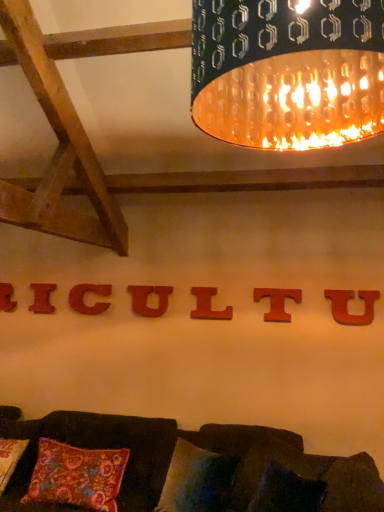
Describe the element at coordinates (277, 302) in the screenshot. I see `wooden letter t at center, which is counted as the sixth alphabet, starting from the left` at that location.

What do you see at coordinates (197, 480) in the screenshot? I see `multicolored fabric pillow at lower center, which appears as the 2th pillow when viewed from the left` at bounding box center [197, 480].

Find the location of a particular element. This screenshot has height=512, width=384. wooden letter l at center, placed as the third alphabet when sorted from right to left is located at coordinates (208, 305).

What is the approximate width of matte wood letter u at center, the 1th alphabet viewed from the right?

matte wood letter u at center, the 1th alphabet viewed from the right, is 2.55 inches in width.

In order to click on matte wood letter u at center, the 1th alphabet viewed from the right in this screenshot , I will do `click(347, 306)`.

The height and width of the screenshot is (512, 384). What are the coordinates of `floral fabric pillow at lower center, acting as the third pillow starting from the left` in the screenshot? It's located at (269, 463).

Find the location of `red matte letter c at center, which is the fifth alphabet in right-to-left order`. red matte letter c at center, which is the fifth alphabet in right-to-left order is located at coordinates [x=84, y=296].

The height and width of the screenshot is (512, 384). I want to click on wooden letter t at center, acting as the second alphabet starting from the right, so click(x=277, y=302).

What are the coordinates of `studio couch located below the metallic textured lampshade at upper center (from the image's perspective)` in the screenshot? It's located at (182, 468).

Which is correct: metallic textured lampshade at upper center is inside velvet dark brown couch at lower center, or outside of it?

metallic textured lampshade at upper center lies outside velvet dark brown couch at lower center.

Between point (331, 125) and point (328, 509), which one is positioned in front?

The point (331, 125) is closer.

Based on the photo, considering the sizes of objects velvety floral pillow at lower left, placed as the 1th pillow when sorted from left to right, and multicolored fabric pillow at lower center, which appears as the 2th pillow when viewed from the left, in the image provided, who is smaller, velvety floral pillow at lower left, placed as the 1th pillow when sorted from left to right, or multicolored fabric pillow at lower center, which appears as the 2th pillow when viewed from the left,?

Smaller between the two is multicolored fabric pillow at lower center, which appears as the 2th pillow when viewed from the left.

Does velvety floral pillow at lower left, the 3th pillow viewed from the right, have a greater height compared to multicolored fabric pillow at lower center, the second pillow when ordered from right to left?

Yes.

From a real-world perspective, between velvety floral pillow at lower left, the 3th pillow viewed from the right, and multicolored fabric pillow at lower center, which appears as the 2th pillow when viewed from the left, who is vertically lower?

In real-world perspective, velvety floral pillow at lower left, the 3th pillow viewed from the right, is lower.

Can you confirm if velvety floral pillow at lower left, the 3th pillow viewed from the right, is wider than multicolored fabric pillow at lower center, the second pillow when ordered from right to left?

Indeed, velvety floral pillow at lower left, the 3th pillow viewed from the right, has a greater width compared to multicolored fabric pillow at lower center, the second pillow when ordered from right to left.

Is point (170, 293) closer or farther from the camera than point (206, 309)?

Point (170, 293) is positioned farther from the camera compared to point (206, 309).

How many degrees apart are the facing directions of matte wood letter u at center, which is counted as the fourth alphabet, starting from the left, and wooden letter l at center, placed as the third alphabet when sorted from right to left?

The angle between the facing direction of matte wood letter u at center, which is counted as the fourth alphabet, starting from the left, and the facing direction of wooden letter l at center, placed as the third alphabet when sorted from right to left, is 0.00757 degrees.

From the image's perspective, which one is positioned lower, matte wood letter u at center, placed as the fourth alphabet when sorted from right to left, or wooden letter l at center, placed as the third alphabet when sorted from right to left?

From the image's view, matte wood letter u at center, placed as the fourth alphabet when sorted from right to left, is below.

In the scene shown: Considering the sizes of matte wood letter u at center, placed as the fourth alphabet when sorted from right to left, and wooden letter l at center, placed as the third alphabet when sorted from right to left, in the image, is matte wood letter u at center, placed as the fourth alphabet when sorted from right to left, wider or thinner than wooden letter l at center, placed as the third alphabet when sorted from right to left,?

In the image, matte wood letter u at center, placed as the fourth alphabet when sorted from right to left, appears to be more narrow than wooden letter l at center, placed as the third alphabet when sorted from right to left.

Is multicolored fabric pillow at lower center, which appears as the 2th pillow when viewed from the left, placed right next to matte wood letter u at center, placed as the fourth alphabet when sorted from right to left?

They are not placed beside each other.

What's the angular difference between multicolored fabric pillow at lower center, the second pillow when ordered from right to left, and matte wood letter u at center, which is counted as the fourth alphabet, starting from the left,'s facing directions?

The angle between the facing direction of multicolored fabric pillow at lower center, the second pillow when ordered from right to left, and the facing direction of matte wood letter u at center, which is counted as the fourth alphabet, starting from the left, is 19.5 degrees.

Between multicolored fabric pillow at lower center, the second pillow when ordered from right to left, and matte wood letter u at center, which is counted as the fourth alphabet, starting from the left, which one has less height?

With less height is matte wood letter u at center, which is counted as the fourth alphabet, starting from the left.

From the picture: Is matte wood letter u at center, which ranks as the 7th alphabet in left-to-right order, oriented away from velvet dark brown couch at lower center?

No, matte wood letter u at center, which ranks as the 7th alphabet in left-to-right order, is not facing away from velvet dark brown couch at lower center.

Does matte wood letter u at center, which ranks as the 7th alphabet in left-to-right order, have a lesser width compared to velvet dark brown couch at lower center?

Indeed, matte wood letter u at center, which ranks as the 7th alphabet in left-to-right order, has a lesser width compared to velvet dark brown couch at lower center.

Which is more to the right, matte wood letter u at center, the 1th alphabet viewed from the right, or velvet dark brown couch at lower center?

matte wood letter u at center, the 1th alphabet viewed from the right.

Which of these two, velvety floral pillow at lower left, placed as the 1th pillow when sorted from left to right, or wooden letter t at center, acting as the second alphabet starting from the right, stands shorter?

wooden letter t at center, acting as the second alphabet starting from the right.

This screenshot has height=512, width=384. In order to click on the 1st pillow in front of the wooden letter t at center, acting as the second alphabet starting from the right in this screenshot , I will do `click(77, 476)`.

From a real-world perspective, relative to wooden letter t at center, acting as the second alphabet starting from the right, is velvety floral pillow at lower left, the 3th pillow viewed from the right, vertically above or below?

From a real-world perspective, velvety floral pillow at lower left, the 3th pillow viewed from the right, is physically below wooden letter t at center, acting as the second alphabet starting from the right.

Between point (178, 505) and point (103, 311), which one is positioned in front?

Point (178, 505)

Based on the photo, from a real-world perspective, is multicolored fabric pillow at lower center, the second pillow when ordered from right to left, below red matte letter c at center, which appears as the third alphabet when viewed from the left?

Yes, from a real-world perspective, multicolored fabric pillow at lower center, the second pillow when ordered from right to left, is below red matte letter c at center, which appears as the third alphabet when viewed from the left.

Does multicolored fabric pillow at lower center, which appears as the 2th pillow when viewed from the left, turn towards red matte letter c at center, which is the fifth alphabet in right-to-left order?

No, multicolored fabric pillow at lower center, which appears as the 2th pillow when viewed from the left, is not oriented towards red matte letter c at center, which is the fifth alphabet in right-to-left order.

Visually, is multicolored fabric pillow at lower center, which appears as the 2th pillow when viewed from the left, positioned to the left or to the right of red matte letter c at center, which appears as the third alphabet when viewed from the left?

multicolored fabric pillow at lower center, which appears as the 2th pillow when viewed from the left, is to the right of red matte letter c at center, which appears as the third alphabet when viewed from the left.

This screenshot has width=384, height=512. Find the location of `studio couch directly beneath the metallic textured lampshade at upper center (from a real-world perspective)`. studio couch directly beneath the metallic textured lampshade at upper center (from a real-world perspective) is located at coordinates (182, 468).

The height and width of the screenshot is (512, 384). I want to click on pillow located on the left of multicolored fabric pillow at lower center, the second pillow when ordered from right to left, so click(x=77, y=476).

Looking at the image, which one is located further to wooden letter t at center, which is counted as the sixth alphabet, starting from the left, wooden letter l at center, placed as the third alphabet when sorted from right to left, or metallic textured lampshade at upper center?

metallic textured lampshade at upper center lies further to wooden letter t at center, which is counted as the sixth alphabet, starting from the left, than the other object.

Based on their spatial positions, is velvety floral pillow at lower left, the 3th pillow viewed from the right, or multicolored fabric pillow at lower center, the second pillow when ordered from right to left, closer to wooden letter t at center, which is counted as the sixth alphabet, starting from the left?

multicolored fabric pillow at lower center, the second pillow when ordered from right to left, is closer to wooden letter t at center, which is counted as the sixth alphabet, starting from the left.

Looking at the image, which one is located further to metallic textured lampshade at upper center, wooden letter t at center, which is counted as the sixth alphabet, starting from the left, or wooden letter at center, arranged as the first alphabet when viewed from the left?

wooden letter at center, arranged as the first alphabet when viewed from the left, is positioned further to the anchor metallic textured lampshade at upper center.

Consider the image. Based on their spatial positions, is velvety floral pillow at lower left, the 3th pillow viewed from the right, or floral fabric pillow at lower center, acting as the third pillow starting from the left, closer to velvet dark brown couch at lower center?

velvety floral pillow at lower left, the 3th pillow viewed from the right, lies closer to velvet dark brown couch at lower center than the other object.

Based on the photo, looking at the image, which one is located further to multicolored fabric pillow at lower center, which appears as the 2th pillow when viewed from the left, velvet dark brown couch at lower center or wooden letter l at center, which is the fifth alphabet in left-to-right order?

wooden letter l at center, which is the fifth alphabet in left-to-right order, is further to multicolored fabric pillow at lower center, which appears as the 2th pillow when viewed from the left.

Considering their positions, is velvet dark brown couch at lower center positioned further to red matte letter c at center, which is the fifth alphabet in right-to-left order, than wooden letter t at center, acting as the second alphabet starting from the right?

wooden letter t at center, acting as the second alphabet starting from the right, is further to red matte letter c at center, which is the fifth alphabet in right-to-left order.

Considering their positions, is wooden letter t at center, acting as the second alphabet starting from the right, positioned further to wooden letter l at center, placed as the third alphabet when sorted from right to left, than velvety floral pillow at lower left, placed as the 1th pillow when sorted from left to right?

velvety floral pillow at lower left, placed as the 1th pillow when sorted from left to right.

When comparing their distances from red wood letter i at center, placed as the 2th alphabet when sorted from left to right, does velvety floral pillow at lower left, the 3th pillow viewed from the right, or wooden letter l at center, which is the fifth alphabet in left-to-right order, seem further?

Among the two, velvety floral pillow at lower left, the 3th pillow viewed from the right, is located further to red wood letter i at center, placed as the 2th alphabet when sorted from left to right.

Identify the location of alphabet between red wood letter i at center, the 6th alphabet viewed from the right, and matte wood letter u at center, which is counted as the fourth alphabet, starting from the left, from left to right. The image size is (384, 512). (84, 296).

Locate an element on the screen. studio couch positioned between metallic textured lampshade at upper center and red wood letter i at center, the 6th alphabet viewed from the right, from near to far is located at coordinates (182, 468).

At what (x,y) coordinates should I click in order to perform the action: click on pillow between velvety floral pillow at lower left, the 3th pillow viewed from the right, and floral fabric pillow at lower center, acting as the third pillow starting from the left. Please return your answer as a coordinate pair (x, y). The image size is (384, 512). Looking at the image, I should click on (197, 480).

Where is `alphabet between red matte letter c at center, which appears as the third alphabet when viewed from the left, and wooden letter l at center, which is the fifth alphabet in left-to-right order`? This screenshot has width=384, height=512. alphabet between red matte letter c at center, which appears as the third alphabet when viewed from the left, and wooden letter l at center, which is the fifth alphabet in left-to-right order is located at coordinates (147, 298).